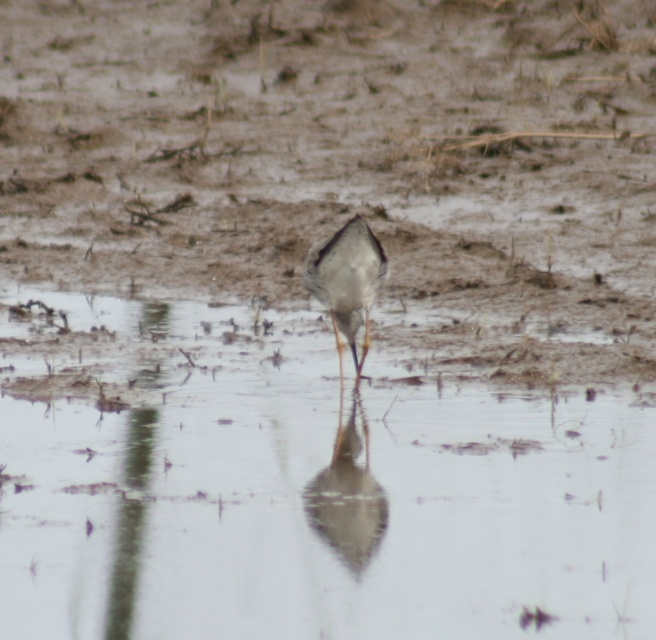
Question: Is clear water at center thinner than gray matte bird at center?

Choices:
 (A) no
 (B) yes

Answer: (A)

Question: Where is smooth gray bird at center located in relation to gray matte bird at center in the image?

Choices:
 (A) right
 (B) left

Answer: (A)

Question: Which object is closer to the camera taking this photo?

Choices:
 (A) smooth gray bird at center
 (B) clear water at center

Answer: (B)

Question: Which point is farther from the camera taking this photo?

Choices:
 (A) (255, 548)
 (B) (352, 225)
 (C) (352, 532)

Answer: (B)

Question: Can you confirm if smooth gray bird at center is bigger than gray matte bird at center?

Choices:
 (A) yes
 (B) no

Answer: (B)

Question: Which object is positioned closest to the gray matte bird at center?

Choices:
 (A) clear water at center
 (B) smooth gray bird at center

Answer: (B)